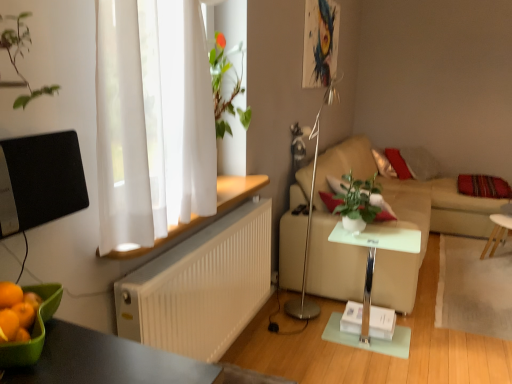
Question: Should I look upward or downward to see green glossy houseplant at center?

Choices:
 (A) up
 (B) down

Answer: (B)

Question: Is white ribbed radiator at lower left looking in the opposite direction of green glossy houseplant at center?

Choices:
 (A) no
 (B) yes

Answer: (A)

Question: From the image's perspective, is white ribbed radiator at lower left under green glossy houseplant at center?

Choices:
 (A) yes
 (B) no

Answer: (A)

Question: Are white ribbed radiator at lower left and green glossy houseplant at center located far from each other?

Choices:
 (A) no
 (B) yes

Answer: (A)

Question: Is white ribbed radiator at lower left at the right side of green glossy houseplant at center?

Choices:
 (A) no
 (B) yes

Answer: (A)

Question: Considering the relative sizes of white ribbed radiator at lower left and green glossy houseplant at center in the image provided, is white ribbed radiator at lower left taller than green glossy houseplant at center?

Choices:
 (A) yes
 (B) no

Answer: (A)

Question: Can you confirm if white ribbed radiator at lower left is thinner than green glossy houseplant at center?

Choices:
 (A) no
 (B) yes

Answer: (B)

Question: Can you confirm if green glossy houseplant at center is thinner than beige fabric couch at right?

Choices:
 (A) no
 (B) yes

Answer: (B)

Question: Does green glossy houseplant at center appear on the right side of beige fabric couch at right?

Choices:
 (A) no
 (B) yes

Answer: (A)

Question: Is green glossy houseplant at center outside of beige fabric couch at right?

Choices:
 (A) yes
 (B) no

Answer: (A)

Question: Is green glossy houseplant at center smaller than beige fabric couch at right?

Choices:
 (A) no
 (B) yes

Answer: (B)

Question: Is green glossy houseplant at center turned away from beige fabric couch at right?

Choices:
 (A) no
 (B) yes

Answer: (A)

Question: Does green glossy houseplant at center have a lesser height compared to beige fabric couch at right?

Choices:
 (A) yes
 (B) no

Answer: (A)

Question: From the image's perspective, would you say white glossy side table at center, marked as the 2th table in a right-to-left arrangement, is shown under silver metallic floor lamp at center?

Choices:
 (A) no
 (B) yes

Answer: (B)